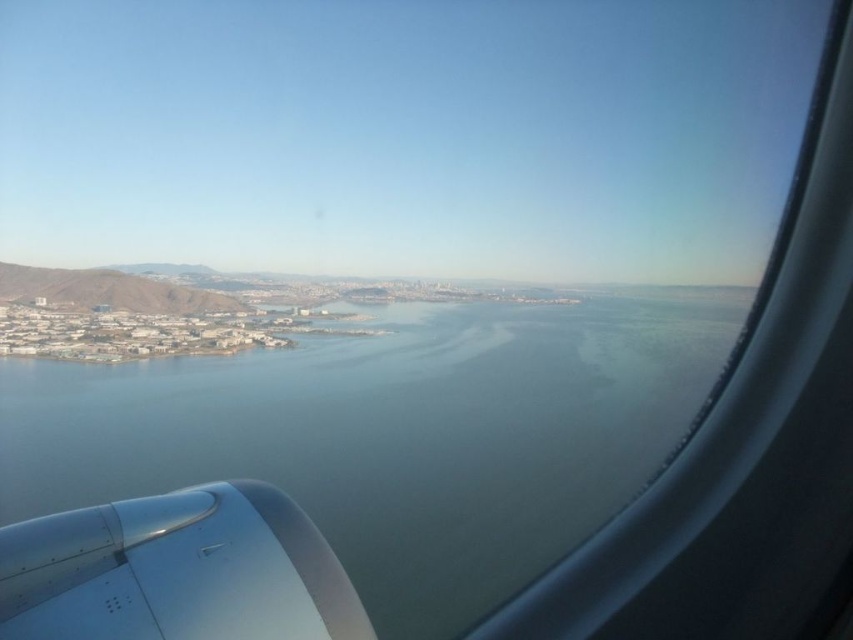
Locate an element on the screen. The height and width of the screenshot is (640, 853). silver metallic engine at lower left is located at coordinates (177, 570).

The image size is (853, 640). What do you see at coordinates (177, 570) in the screenshot? I see `silver metallic engine at lower left` at bounding box center [177, 570].

Where is `silver metallic engine at lower left`? This screenshot has width=853, height=640. silver metallic engine at lower left is located at coordinates (177, 570).

Between clear blue water at center and green grassy hillside at left, which one appears on the right side from the viewer's perspective?

From the viewer's perspective, clear blue water at center appears more on the right side.

Can you confirm if clear blue water at center is positioned below green grassy hillside at left?

Yes.

Who is more distant from viewer, (10, 472) or (50, 268)?

The point (50, 268) is more distant.

You are a GUI agent. You are given a task and a screenshot of the screen. Output one action in this format:
    pyautogui.click(x=<x>, y=<y>)
    Task: Click on the clear blue water at center
    
    Given the screenshot: What is the action you would take?
    pyautogui.click(x=396, y=435)

Describe the element at coordinates (396, 435) in the screenshot. I see `clear blue water at center` at that location.

Who is more forward, (471,314) or (126,568)?

Point (126,568) is more forward.

Identify the location of clear blue water at center. This screenshot has width=853, height=640. (396, 435).